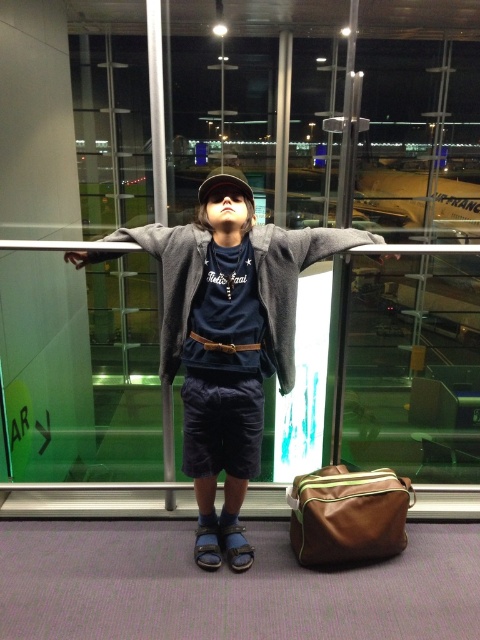
Is matte gray hoodie at center positioned at the back of brown leather bag at lower right?

No, matte gray hoodie at center is closer to the viewer.

Is point (225, 518) closer to camera compared to point (334, 512)?

No.

Locate an element on the screen. matte gray hoodie at center is located at coordinates (228, 339).

Image resolution: width=480 pixels, height=640 pixels. What are the coordinates of `matte gray hoodie at center` in the screenshot? It's located at (228, 339).

Is matte gray hoodie at center shorter than brown leather belt at center?

Incorrect, matte gray hoodie at center's height does not fall short of brown leather belt at center's.

This screenshot has height=640, width=480. What do you see at coordinates (228, 339) in the screenshot? I see `matte gray hoodie at center` at bounding box center [228, 339].

Based on the photo, who is more distant from viewer, (291, 248) or (194, 333)?

The point (291, 248) is more distant.

This screenshot has height=640, width=480. I want to click on matte gray hoodie at center, so [x=228, y=339].

This screenshot has width=480, height=640. What do you see at coordinates (348, 515) in the screenshot?
I see `brown leather bag at lower right` at bounding box center [348, 515].

Where is `brown leather bag at lower right`? brown leather bag at lower right is located at coordinates (348, 515).